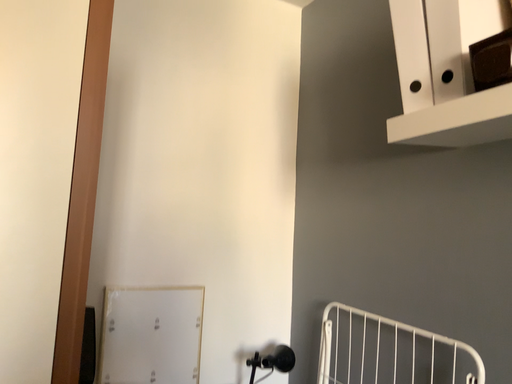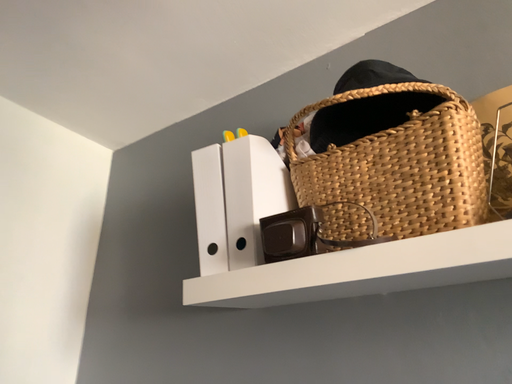
Question: How did the camera likely rotate when shooting the video?

Choices:
 (A) rotated left
 (B) rotated right

Answer: (B)